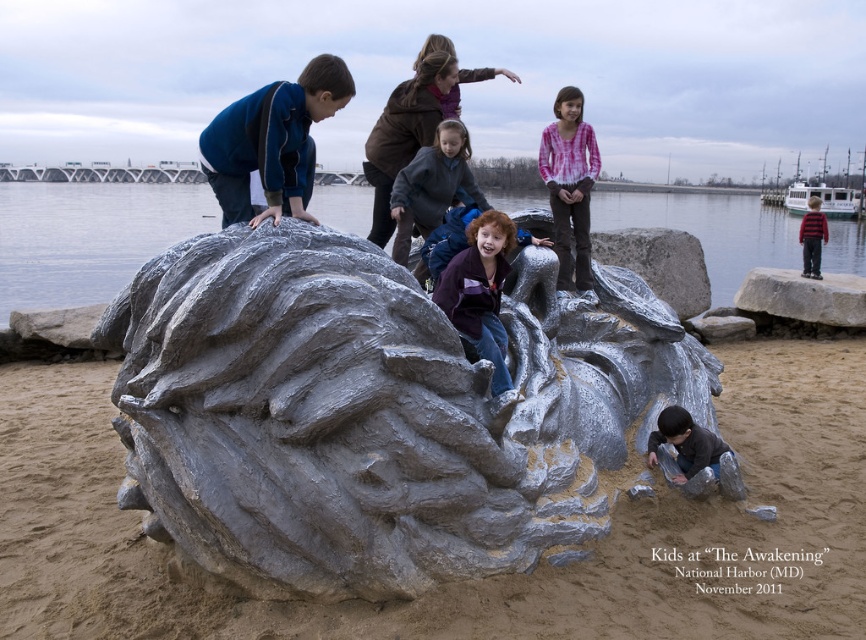
You are a photographer trying to capture the gray stone boulder at right and the brushed metal sculpture at lower right in the same frame. Based on their positions, which object should you focus on first to ensure both are in the shot?

The gray stone boulder at right is located above the brushed metal sculpture at lower right, so you should focus on the brushed metal sculpture at lower right first to ensure both are in the frame.